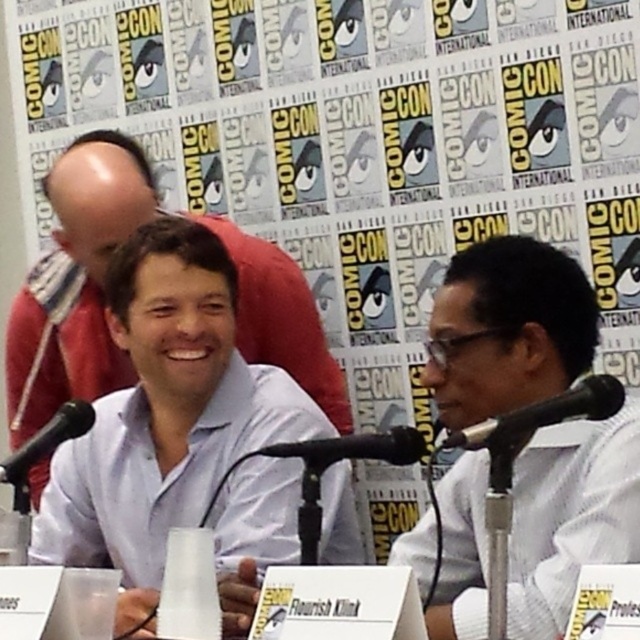
Question: Estimate the real-world distances between objects in this image. Which object is closer to the black matte microphone at center?

Choices:
 (A) black matte microphone at left
 (B) white textured shirt at right
 (C) light blue shirt at center

Answer: (B)

Question: Which of the following is the farthest from the observer?

Choices:
 (A) (58, 410)
 (B) (525, 513)
 (C) (369, 458)
 (D) (48, 358)

Answer: (A)

Question: Among these points, which one is farthest from the camera?

Choices:
 (A) (580, 380)
 (B) (305, 456)
 (C) (300, 275)
 (D) (76, 412)

Answer: (C)

Question: Can you confirm if light blue shirt at center is positioned below black plastic microphone at center?

Choices:
 (A) yes
 (B) no

Answer: (B)

Question: Is black matte microphone at center in front of black matte microphone at left?

Choices:
 (A) yes
 (B) no

Answer: (A)

Question: Considering the relative positions of black matte microphone at center and black plastic microphone at center in the image provided, where is black matte microphone at center located with respect to black plastic microphone at center?

Choices:
 (A) left
 (B) right

Answer: (B)